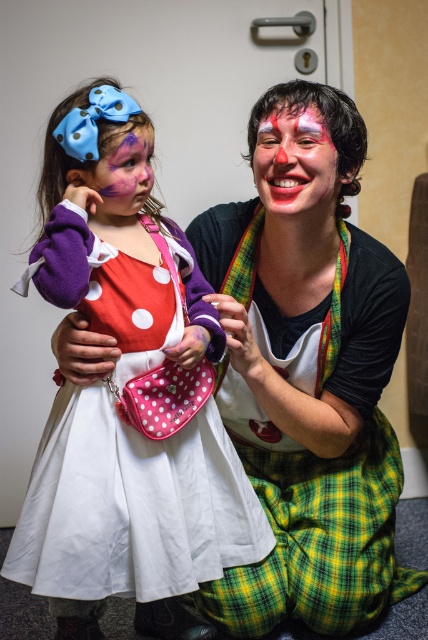
Question: Does matte clown face at center have a smaller size compared to matte purple face at center?

Choices:
 (A) yes
 (B) no

Answer: (B)

Question: Based on their relative distances, which object is farther from the white polka dot dress at center?

Choices:
 (A) matte clown face at center
 (B) matte purple face at center

Answer: (A)

Question: Which point is closer to the camera taking this photo?

Choices:
 (A) (278, 182)
 (B) (107, 198)
 (C) (270, 538)

Answer: (B)

Question: Where is white polka dot dress at center located in relation to matte purple face at center in the image?

Choices:
 (A) left
 (B) right

Answer: (A)

Question: Is matte clown face at center thinner than matte purple face at center?

Choices:
 (A) no
 (B) yes

Answer: (A)

Question: Which of the following is the closest to the observer?

Choices:
 (A) matte purple face at center
 (B) white polka dot dress at center
 (C) matte clown face at center

Answer: (B)